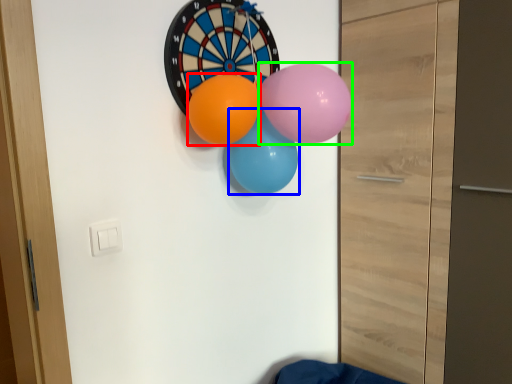
Question: Which object is the farthest from balloon (highlighted by a red box)? Choose among these: balloon (highlighted by a blue box) or balloon (highlighted by a green box).

Choices:
 (A) balloon
 (B) balloon

Answer: (B)